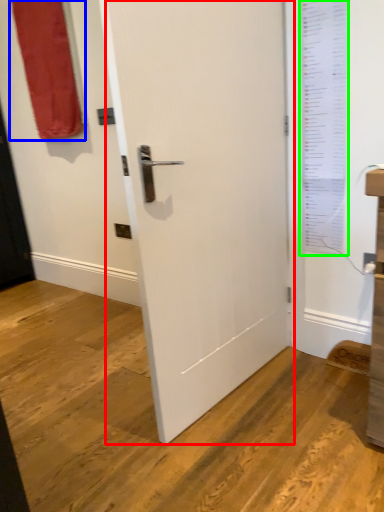
Question: Based on their relative distances, which object is nearer to door (highlighted by a red box)? Choose from curtain (highlighted by a blue box) and window screen (highlighted by a green box).

Choices:
 (A) curtain
 (B) window screen

Answer: (B)